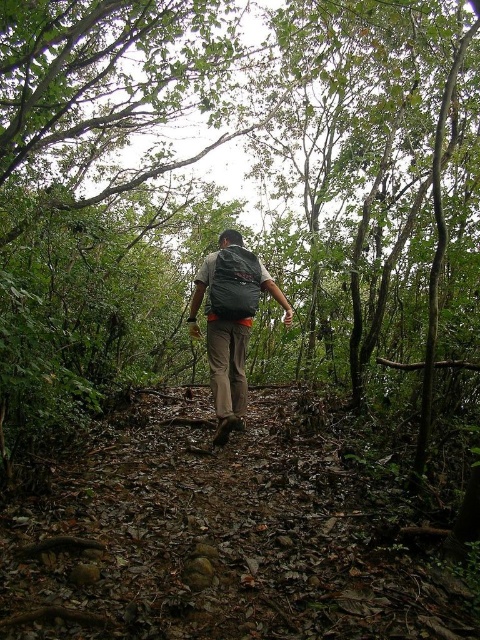
Describe the element at coordinates (230, 323) in the screenshot. I see `matte black backpack at center` at that location.

Is matte black backpack at center above dark gray fabric backpack at center?

Incorrect, matte black backpack at center is not positioned above dark gray fabric backpack at center.

Which is behind, point (208, 356) or point (236, 280)?

Positioned behind is point (208, 356).

Locate an element on the screen. matte black backpack at center is located at coordinates (230, 323).